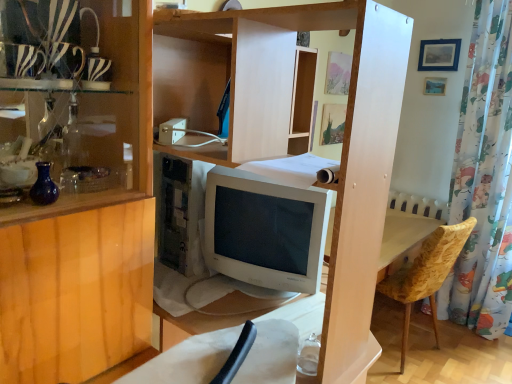
Question: Considering the positions of zebra-patterned glass at upper left and floral fabric shower curtain at right in the image, is zebra-patterned glass at upper left wider or thinner than floral fabric shower curtain at right?

Choices:
 (A) thin
 (B) wide

Answer: (A)

Question: From a real-world perspective, is zebra-patterned glass at upper left physically located above or below floral fabric shower curtain at right?

Choices:
 (A) above
 (B) below

Answer: (A)

Question: Which object is positioned farthest from the floral fabric shower curtain at right?

Choices:
 (A) velvet yellow chair at lower right
 (B) white glossy computer monitor at center
 (C) blue matte picture frame at upper right
 (D) zebra-patterned glass at upper left
 (E) blue glass vase at left

Answer: (E)

Question: Which object is positioned closest to the blue matte picture frame at upper right?

Choices:
 (A) floral fabric shower curtain at right
 (B) white glossy computer monitor at center
 (C) velvet yellow chair at lower right
 (D) blue glass vase at left
 (E) zebra-patterned glass at upper left

Answer: (A)